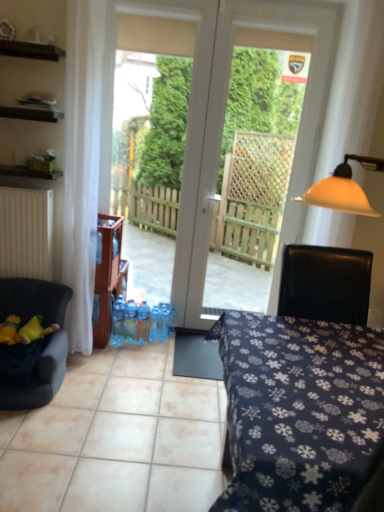
The height and width of the screenshot is (512, 384). What do you see at coordinates (9, 330) in the screenshot?
I see `yellow fabric toy at lower left, marked as the 2th toy in a right-to-left arrangement` at bounding box center [9, 330].

Identify the location of white glossy door at center. (223, 123).

The height and width of the screenshot is (512, 384). What are the coordinates of `clear plastic bottles at center, the fifth bottle from the right` in the screenshot? It's located at (118, 321).

What do you see at coordinates (31, 114) in the screenshot? I see `wooden cabinet at upper left, the second cabinetry positioned from the bottom` at bounding box center [31, 114].

Identify the location of dark blue fabric table at center. Image resolution: width=384 pixels, height=512 pixels. (299, 411).

I want to click on wooden cabinet at left, so click(x=107, y=276).

Find the location of a particular element. Image resolution: width=384 pixels, height=512 pixels. blue plastic bottle at center, which ranks as the fifth bottle in left-to-right order is located at coordinates (163, 322).

Does point (165, 334) appear closer or farther from the camera than point (141, 340)?

Point (165, 334) is farther from the camera than point (141, 340).

Is blue plastic bottle at center, marked as the third bottle in a left-to-right arrangement, at the back of blue plastic bottle at center, which ranks as the fifth bottle in left-to-right order?

No, blue plastic bottle at center, which ranks as the fifth bottle in left-to-right order,'s orientation is not away from blue plastic bottle at center, marked as the third bottle in a left-to-right arrangement.

How distant is blue plastic bottle at center, the 1th bottle in the right-to-left sequence, from blue plastic bottle at center, marked as the third bottle in a left-to-right arrangement?

A distance of 4.60 inches exists between blue plastic bottle at center, the 1th bottle in the right-to-left sequence, and blue plastic bottle at center, marked as the third bottle in a left-to-right arrangement.

Can we say blue plastic bottle at center, which ranks as the fifth bottle in left-to-right order, lies outside blue plastic bottle at center, the third bottle in the right-to-left sequence?

Yes.

Which is correct: white glossy tile at lower left is inside blue plastic bottle at center, marked as the third bottle in a left-to-right arrangement, or outside of it?

white glossy tile at lower left is outside blue plastic bottle at center, marked as the third bottle in a left-to-right arrangement.

From a real-world perspective, which is physically above, white glossy tile at lower left or blue plastic bottle at center, marked as the third bottle in a left-to-right arrangement?

blue plastic bottle at center, marked as the third bottle in a left-to-right arrangement, is physically above.

Is white glossy tile at lower left oriented towards blue plastic bottle at center, the third bottle in the right-to-left sequence?

No, white glossy tile at lower left is not oriented towards blue plastic bottle at center, the third bottle in the right-to-left sequence.

From their relative heights in the image, would you say white glossy tile at lower left is taller or shorter than white glossy door at center?

white glossy tile at lower left is shorter than white glossy door at center.

Which is more to the left, white glossy tile at lower left or white glossy door at center?

white glossy tile at lower left.

Considering the sizes of objects white glossy tile at lower left and white glossy door at center in the image provided, who is wider, white glossy tile at lower left or white glossy door at center?

Wider between the two is white glossy tile at lower left.

Is white glossy tile at lower left positioned with its back to white glossy door at center?

No.

Measure the distance between yellow plush toy at left, the 1th toy when ordered from right to left, and white glossy door at center.

They are 4.92 feet apart.

Who is shorter, yellow plush toy at left, arranged as the 2th toy when viewed from the left, or white glossy door at center?

yellow plush toy at left, arranged as the 2th toy when viewed from the left.

You are a GUI agent. You are given a task and a screenshot of the screen. Output one action in this format:
    pyautogui.click(x=<x>, y=<y>)
    Task: Click on the door that is behind the yellow plush toy at left, the 1th toy when ordered from right to left
    
    Given the screenshot: What is the action you would take?
    pyautogui.click(x=223, y=123)

From the image's perspective, is yellow plush toy at left, arranged as the 2th toy when viewed from the left, below white glossy door at center?

Yes.

Between clear plastic bottles at center, the fifth bottle from the right, and matte black shelf at upper left, arranged as the 1th cabinetry when ordered from the bottom, which one has smaller size?

clear plastic bottles at center, the fifth bottle from the right.

Looking at this image, which object is closer to the camera, clear plastic bottles at center, the first bottle positioned from the left, or matte black shelf at upper left, the 2th cabinetry in the top-to-bottom sequence?

matte black shelf at upper left, the 2th cabinetry in the top-to-bottom sequence, is closer to the camera.

Based on the photo, is clear plastic bottles at center, the fifth bottle from the right, not inside matte black shelf at upper left, arranged as the 1th cabinetry when ordered from the bottom?

clear plastic bottles at center, the fifth bottle from the right, is positioned outside matte black shelf at upper left, arranged as the 1th cabinetry when ordered from the bottom.

From the image's perspective, is clear plastic bottles at center, the first bottle positioned from the left, beneath matte black shelf at upper left, arranged as the 1th cabinetry when ordered from the bottom?

Yes, from the image's perspective, clear plastic bottles at center, the first bottle positioned from the left, is below matte black shelf at upper left, arranged as the 1th cabinetry when ordered from the bottom.

Which of these two, velvet dark blue chair at left or yellow fabric toy at lower left, marked as the 2th toy in a right-to-left arrangement, stands shorter?

yellow fabric toy at lower left, marked as the 2th toy in a right-to-left arrangement.

Is velvet dark blue chair at left in front of or behind yellow fabric toy at lower left, positioned as the 1th toy in left-to-right order, in the image?

Clearly, velvet dark blue chair at left is in front of yellow fabric toy at lower left, positioned as the 1th toy in left-to-right order.

From a real-world perspective, is velvet dark blue chair at left positioned over yellow fabric toy at lower left, marked as the 2th toy in a right-to-left arrangement, based on gravity?

No, from a real-world perspective, velvet dark blue chair at left is not above yellow fabric toy at lower left, marked as the 2th toy in a right-to-left arrangement.

Can you tell me how much velvet dark blue chair at left and yellow fabric toy at lower left, marked as the 2th toy in a right-to-left arrangement, differ in facing direction?

The facing directions of velvet dark blue chair at left and yellow fabric toy at lower left, marked as the 2th toy in a right-to-left arrangement, are 2.27 degrees apart.

Between blue plastic bottle at center, the fourth bottle from the left, and white glossy tile at lower left, which one has smaller width?

Thinner between the two is blue plastic bottle at center, the fourth bottle from the left.

In the scene shown: Is blue plastic bottle at center, the fourth bottle from the left, placed right next to white glossy tile at lower left?

There is a gap between blue plastic bottle at center, the fourth bottle from the left, and white glossy tile at lower left.

Based on the photo, from the image's perspective, relative to white glossy tile at lower left, is blue plastic bottle at center, the fourth bottle from the left, above or below?

blue plastic bottle at center, the fourth bottle from the left, is situated higher than white glossy tile at lower left in the image.

The width and height of the screenshot is (384, 512). Find the location of `the 3rd bottle in front of the blue plastic bottle at center, the 1th bottle in the right-to-left sequence, counting from the anchor's position`. the 3rd bottle in front of the blue plastic bottle at center, the 1th bottle in the right-to-left sequence, counting from the anchor's position is located at coordinates (143, 322).

Where is `tile below the blue plastic bottle at center, the third bottle in the right-to-left sequence (from a real-world perspective)`? Image resolution: width=384 pixels, height=512 pixels. tile below the blue plastic bottle at center, the third bottle in the right-to-left sequence (from a real-world perspective) is located at coordinates (117, 438).

Estimate the real-world distances between objects in this image. Which object is further from clear plastic bottles at center, the first bottle positioned from the left, yellow fabric toy at lower left, marked as the 2th toy in a right-to-left arrangement, or matte black shelf at upper left, arranged as the 1th cabinetry when ordered from the bottom?

matte black shelf at upper left, arranged as the 1th cabinetry when ordered from the bottom, is further to clear plastic bottles at center, the first bottle positioned from the left.

Based on the photo, estimate the real-world distances between objects in this image. Which object is further from matte black shelf at upper left, arranged as the 1th cabinetry when ordered from the bottom, dark blue fabric table at center or blue plastic bottle at center, the fourth bottle positioned from the right?

dark blue fabric table at center lies further to matte black shelf at upper left, arranged as the 1th cabinetry when ordered from the bottom, than the other object.

Based on their spatial positions, is blue plastic bottle at center, the fourth bottle positioned from the right, or velvet dark blue chair at left further from clear plastic bottles at center, the fifth bottle from the right?

velvet dark blue chair at left.

From the image, which object appears to be nearer to blue plastic bottle at center, the fourth bottle positioned from the right, yellow fabric toy at lower left, positioned as the 1th toy in left-to-right order, or dark blue fabric table at center?

yellow fabric toy at lower left, positioned as the 1th toy in left-to-right order, is closer to blue plastic bottle at center, the fourth bottle positioned from the right.

Estimate the real-world distances between objects in this image. Which object is further from yellow plush toy at left, the 1th toy when ordered from right to left, white glossy door at center or wooden cabinet at left?

The object further to yellow plush toy at left, the 1th toy when ordered from right to left, is white glossy door at center.

When comparing their distances from velvet dark blue chair at left, does blue plastic bottle at center, the fourth bottle positioned from the right, or dark blue fabric table at center seem further?

Based on the image, dark blue fabric table at center appears to be further to velvet dark blue chair at left.

When comparing their distances from yellow plush toy at left, arranged as the 2th toy when viewed from the left, does blue plastic bottle at center, the fourth bottle from the left, or clear plastic bottles at center, the fifth bottle from the right, seem closer?

clear plastic bottles at center, the fifth bottle from the right, is positioned closer to the anchor yellow plush toy at left, arranged as the 2th toy when viewed from the left.

From the image, which object appears to be nearer to wooden cabinet at left, yellow plush toy at left, the 1th toy when ordered from right to left, or blue plastic bottle at center, which is the 2th bottle from right to left?

The object closer to wooden cabinet at left is blue plastic bottle at center, which is the 2th bottle from right to left.

Locate an element on the screen. bottle between wooden cabinet at upper left, the first cabinetry when ordered from top to bottom, and clear plastic bottles at center, the first bottle positioned from the left, in the vertical direction is located at coordinates point(130,321).

The image size is (384, 512). In order to click on chair between white glossy tile at lower left and yellow fabric toy at lower left, positioned as the 1th toy in left-to-right order, from front to back in this screenshot , I will do `click(45, 345)`.

At what (x,y) coordinates should I click in order to perform the action: click on tile between dark blue fabric table at center and white glossy door at center from front to back. Please return your answer as a coordinate pair (x, y). Looking at the image, I should click on (117, 438).

Image resolution: width=384 pixels, height=512 pixels. I want to click on bottle between white glossy door at center and clear plastic bottles at center, the fifth bottle from the right, in the vertical direction, so click(130, 321).